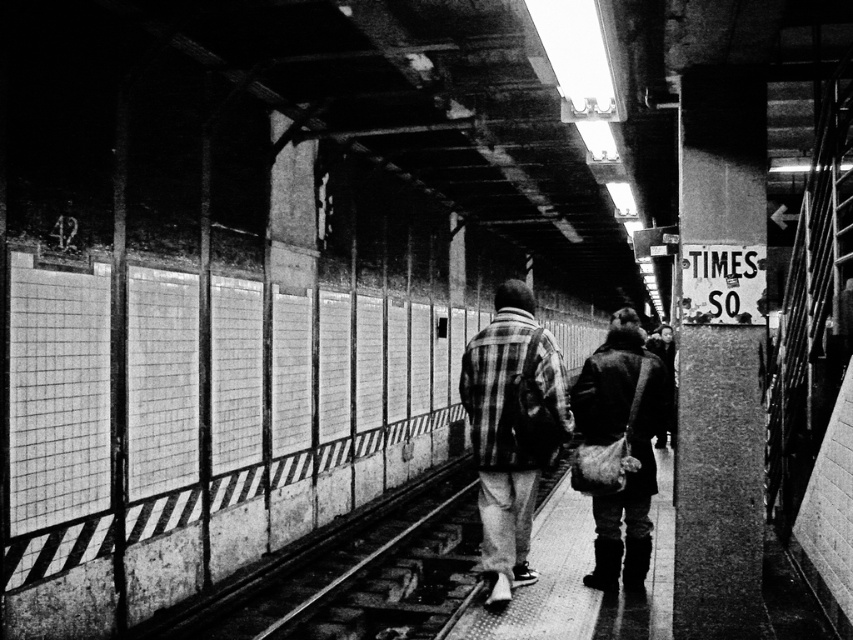
You are a photographer waiting on the subway platform. You see the plaid fabric jacket at center and the leather bag at center. Which object is closer to the left side of the platform?

The plaid fabric jacket at center is closer to the left side of the platform because it is to the left of the leather bag at center.

You are standing at the subway station platform and want to reach the point marked at coordinates point (529, 339). Given that the average walking distance for an adult is about 2.5 feet per second, how many seconds would it take you to reach that point?

The point (529, 339) is 16.93 feet away from you. At a walking speed of 2.5 feet per second, it would take approximately 6.77 seconds to reach the point.

You are standing at the point marked as point (511, 429) in the subway station. Which object is exactly at your current location?

The plaid fabric jacket at center is located at point (511, 429).